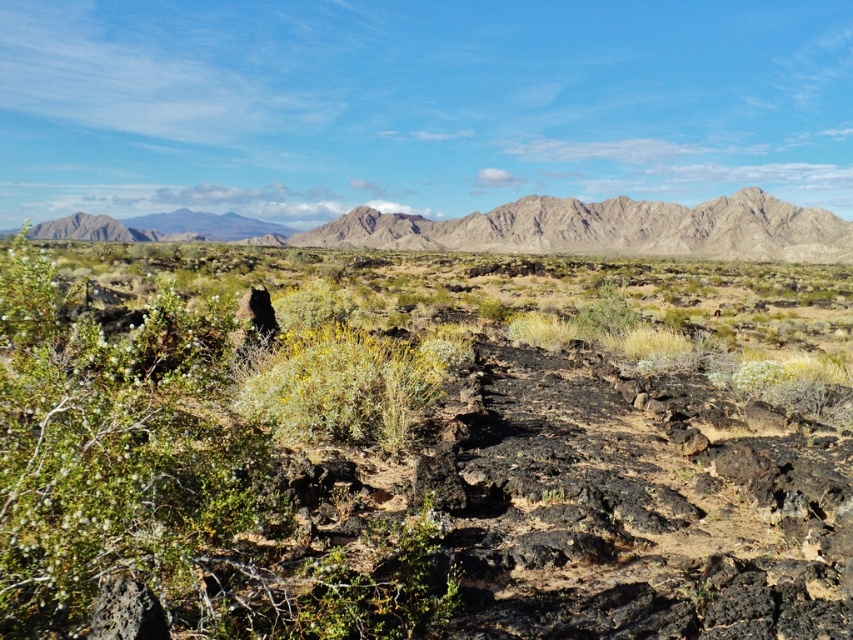
Question: Among these objects, which one is farthest from the camera?

Choices:
 (A) rugged rock mountain at center
 (B) volcanic rock at center

Answer: (A)

Question: Can you confirm if volcanic rock at center is positioned above rugged rock mountain at center?

Choices:
 (A) no
 (B) yes

Answer: (A)

Question: Can you confirm if volcanic rock at center is positioned below rugged rock mountain at center?

Choices:
 (A) yes
 (B) no

Answer: (A)

Question: Is volcanic rock at center further to camera compared to rugged rock mountain at center?

Choices:
 (A) yes
 (B) no

Answer: (B)

Question: Which point is farther to the camera?

Choices:
 (A) (444, 248)
 (B) (444, 330)

Answer: (A)

Question: Which object is farther from the camera taking this photo?

Choices:
 (A) rugged rock mountain at center
 (B) volcanic rock at center

Answer: (A)